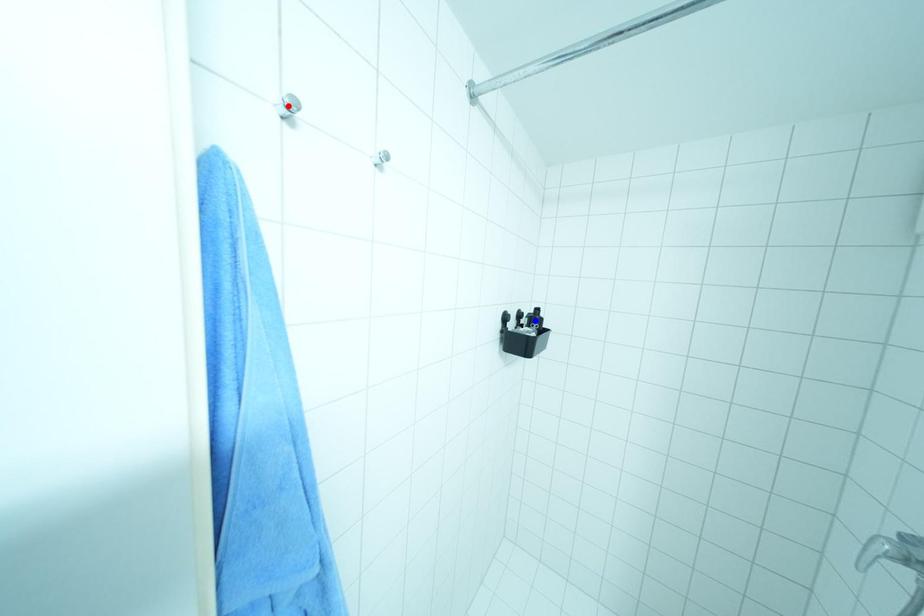
Question: Which of the two points in the image is closer to the camera?

Choices:
 (A) Blue point is closer.
 (B) Red point is closer.

Answer: (B)